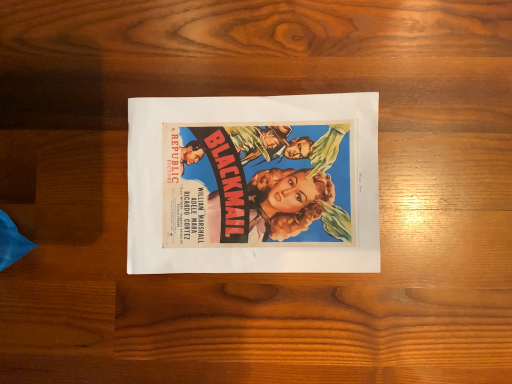
This screenshot has height=384, width=512. What do you see at coordinates (253, 184) in the screenshot?
I see `vivid paper poster at center` at bounding box center [253, 184].

You are a GUI agent. You are given a task and a screenshot of the screen. Output one action in this format:
    pyautogui.click(x=<x>, y=<y>)
    Task: Click on the vivid paper poster at center
    
    Given the screenshot: What is the action you would take?
    pyautogui.click(x=253, y=184)

Where is `vivid paper poster at center`? This screenshot has height=384, width=512. vivid paper poster at center is located at coordinates (253, 184).